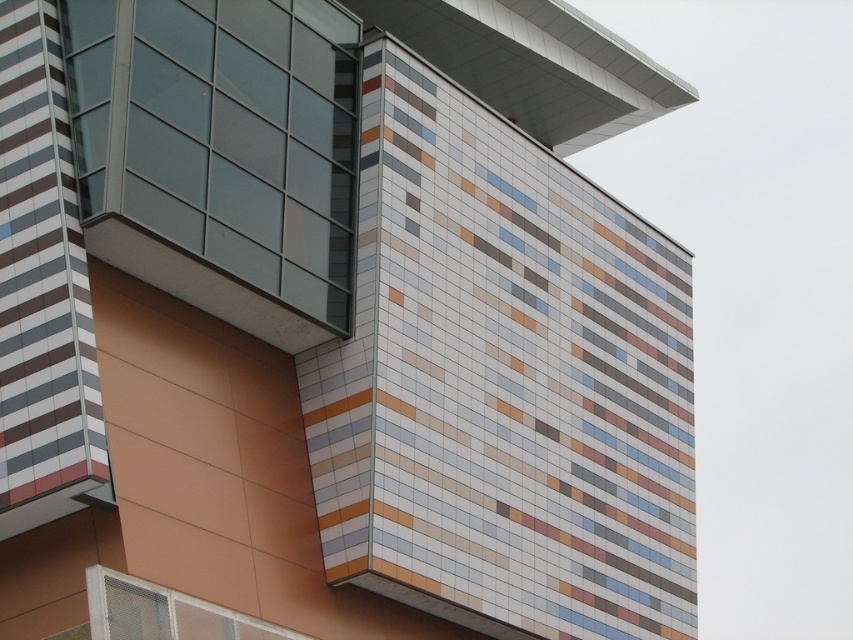
Question: Is transparent glass window at upper left positioned behind white mesh window at lower left?

Choices:
 (A) no
 (B) yes

Answer: (B)

Question: Can you confirm if transparent glass window at upper left is positioned to the right of white mesh window at lower left?

Choices:
 (A) yes
 (B) no

Answer: (B)

Question: Does transparent glass window at upper left appear on the left side of white mesh window at lower left?

Choices:
 (A) yes
 (B) no

Answer: (A)

Question: Among these points, which one is farthest from the camera?

Choices:
 (A) (123, 618)
 (B) (288, 106)

Answer: (B)

Question: Among these objects, which one is farthest from the camera?

Choices:
 (A) white mesh window at lower left
 (B) transparent glass window at upper left

Answer: (B)